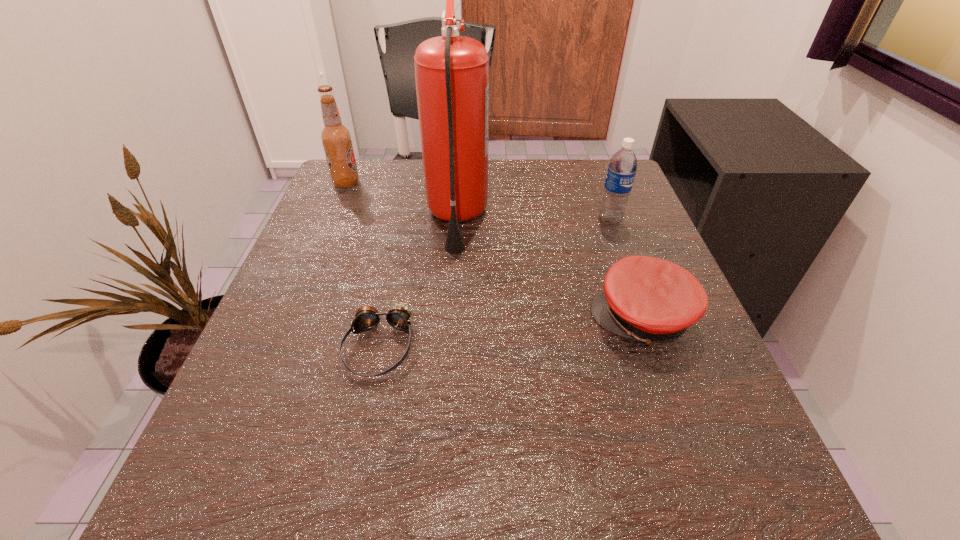
At what (x,y) coordinates should I click in order to perform the action: click on the tallest object. Please return your answer as a coordinate pair (x, y). This screenshot has height=540, width=960. Looking at the image, I should click on (451, 72).

Where is `the fourth shortest object`? The image size is (960, 540). the fourth shortest object is located at coordinates (336, 138).

This screenshot has height=540, width=960. Identify the location of the leftmost object. (336, 138).

This screenshot has height=540, width=960. In order to click on the third tallest object in this screenshot , I will do `click(622, 167)`.

Image resolution: width=960 pixels, height=540 pixels. Find the location of `cap`. cap is located at coordinates (652, 300).

Identify the location of goggles. The width and height of the screenshot is (960, 540). (399, 316).

Find the location of `free location located 0.240m on the instruction side of the tallest object`. free location located 0.240m on the instruction side of the tallest object is located at coordinates tap(599, 219).

In order to click on vacant space positioned on the front label of the leftmost object in this screenshot , I will do `click(527, 183)`.

I want to click on vacant area situated on the front of the water bottle, so click(x=671, y=388).

Identify the location of free space located 0.060m on the front of the fourth tallest object with an emblem. This screenshot has width=960, height=540. (556, 319).